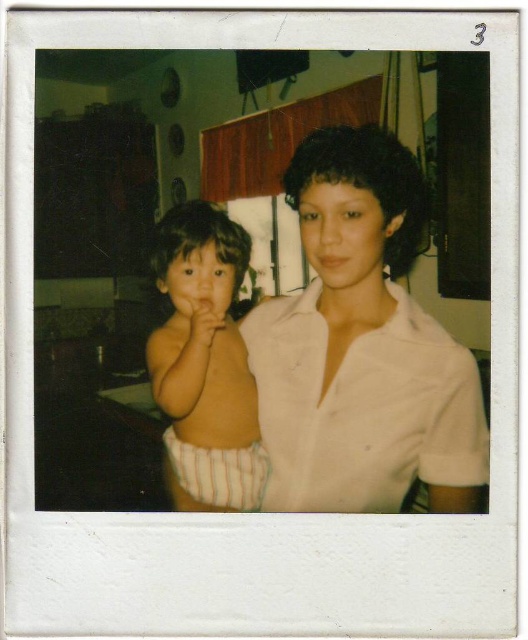
You are looking at the Polaroid photo and notice two points marked in the image. The first point is at coordinates point (397,483) and the second point is at point (200,241). Based on the photo, which point is closer to you?

Point (397,483) is closer to the viewer than point (200,241).

You are a photographer analyzing this vintage Polaroid photo. You notice the white smooth shirt at center and the striped diaper at left. Which object is closer to the camera?

The white smooth shirt at center is closer to the camera because it is in front of the striped diaper at left.